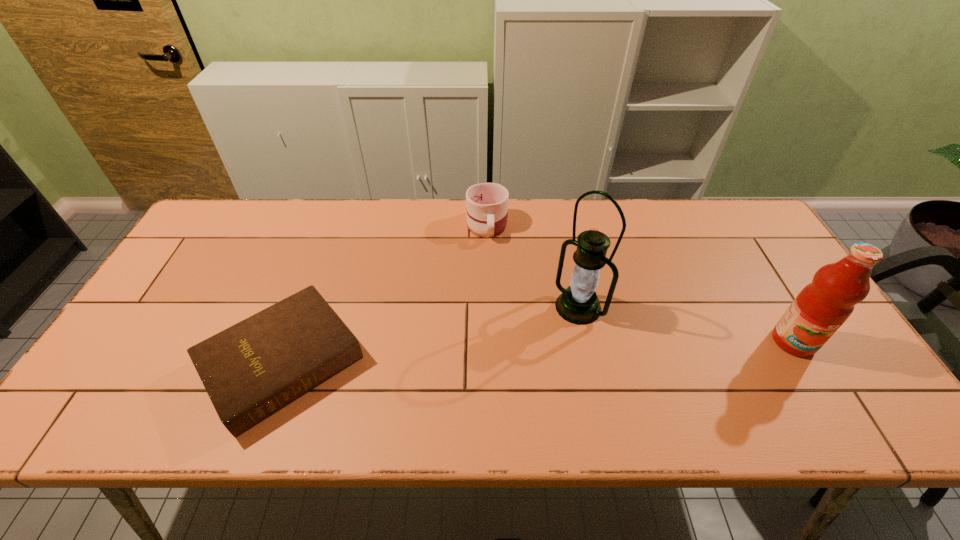
This screenshot has height=540, width=960. What are the coordinates of `free space between the second shortest object and the second object from right to left` in the screenshot? It's located at (533, 266).

This screenshot has height=540, width=960. I want to click on free point between the leftmost object and the second object from right to left, so click(x=431, y=335).

Where is `free space between the tallest object and the rightmost object`? This screenshot has width=960, height=540. free space between the tallest object and the rightmost object is located at coordinates (685, 324).

Image resolution: width=960 pixels, height=540 pixels. I want to click on empty space that is in between the fruit juice and the tallest object, so click(x=685, y=324).

Locate an element on the screen. Image resolution: width=960 pixels, height=540 pixels. the closest object to the rightmost object is located at coordinates (578, 304).

Select which object appears as the second closest to the second object from right to left. Please provide its 2D coordinates. Your answer should be formatted as a tuple, i.e. [(x, y)], where the tuple contains the x and y coordinates of a point satisfying the conditions above.

[(822, 306)]

You are a GUI agent. You are given a task and a screenshot of the screen. Output one action in this format:
    pyautogui.click(x=<x>, y=<y>)
    Task: Click on the blank space that satisfies the following two spatial constraints: 1. on the front side of the lantern; 2. on the right side of the third tallest object
    This screenshot has height=540, width=960.
    Given the screenshot: What is the action you would take?
    pyautogui.click(x=489, y=307)

Where is `vacant space that satisfies the following two spatial constraints: 1. on the front side of the tallest object; 2. on the left side of the farthest object`? This screenshot has width=960, height=540. vacant space that satisfies the following two spatial constraints: 1. on the front side of the tallest object; 2. on the left side of the farthest object is located at coordinates (489, 307).